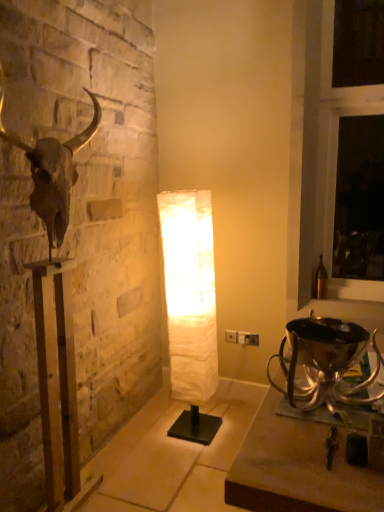
Describe the element at coordinates (190, 308) in the screenshot. The height and width of the screenshot is (512, 384). I see `white paper lamp at center` at that location.

Measure the distance between metallic gold bull skull at left and camera.

They are 1.54 meters apart.

Locate an element on the screen. The height and width of the screenshot is (512, 384). white marble lamp at center is located at coordinates [173, 456].

Looking at this image, how different are the orientations of shiny silver trophy at lower right and metallic gold bull skull at left in degrees?

The facing directions of shiny silver trophy at lower right and metallic gold bull skull at left are 1.25 degrees apart.

How distant is shiny silver trophy at lower right from metallic gold bull skull at left?

A distance of 1.15 meters exists between shiny silver trophy at lower right and metallic gold bull skull at left.

Considering their positions, is shiny silver trophy at lower right located in front of or behind metallic gold bull skull at left?

shiny silver trophy at lower right is in front of metallic gold bull skull at left.

Can you confirm if shiny silver trophy at lower right is smaller than metallic gold bull skull at left?

Correct, shiny silver trophy at lower right occupies less space than metallic gold bull skull at left.

Does white marble lamp at center come in front of white plastic electric outlet at center?

Yes, white marble lamp at center is in front of white plastic electric outlet at center.

Does point (226, 463) lie behind point (243, 332)?

No.

Is white marble lamp at center facing away from white plastic electric outlet at center?

That's not correct — white marble lamp at center is not looking away from white plastic electric outlet at center.

Locate an element on the screen. This screenshot has height=512, width=384. candle holder below the white paper lamp at center (from the image's perspective) is located at coordinates (325, 364).

Does point (185, 342) appear closer or farther from the camera than point (295, 392)?

Point (185, 342) appears to be farther away from the viewer than point (295, 392).

Is white paper lamp at center directly adjacent to shiny silver trophy at lower right?

There is a gap between white paper lamp at center and shiny silver trophy at lower right.

Could you tell me if white paper lamp at center is turned towards shiny silver trophy at lower right?

No.

What's the angular difference between white plastic electric outlet at center and metallic gold bull skull at left's facing directions?

white plastic electric outlet at center and metallic gold bull skull at left are facing 90 degrees away from each other.

This screenshot has height=512, width=384. In order to click on sculpture in front of the white plastic electric outlet at center in this screenshot , I will do `click(55, 304)`.

In the scene shown: Would you consider white plastic electric outlet at center to be distant from metallic gold bull skull at left?

Yes, white plastic electric outlet at center is far from metallic gold bull skull at left.

Is white plastic electric outlet at center oriented towards metallic gold bull skull at left?

No, white plastic electric outlet at center does not turn towards metallic gold bull skull at left.

Can you confirm if white marble lamp at center is smaller than white paper lamp at center?

Indeed, white marble lamp at center has a smaller size compared to white paper lamp at center.

What's the angular difference between white marble lamp at center and white paper lamp at center's facing directions?

The facing directions of white marble lamp at center and white paper lamp at center are 178 degrees apart.

Locate an element on the screen. lamp behind the white marble lamp at center is located at coordinates (190, 308).

In the image, is white marble lamp at center positioned in front of or behind white paper lamp at center?

Clearly, white marble lamp at center is in front of white paper lamp at center.

Based on the photo, from the image's perspective, is white plastic electric outlet at center positioned above or below white paper lamp at center?

From the image's perspective, white plastic electric outlet at center appears below white paper lamp at center.

Who is bigger, white plastic electric outlet at center or white paper lamp at center?

white paper lamp at center is bigger.

Where is `lamp lying above the white plastic electric outlet at center (from the image's perspective)`? The width and height of the screenshot is (384, 512). lamp lying above the white plastic electric outlet at center (from the image's perspective) is located at coordinates (190, 308).

Looking at this image, which object is thinner, white plastic electric outlet at center or white paper lamp at center?

With smaller width is white plastic electric outlet at center.

Does white marble lamp at center touch shiny silver trophy at lower right?

No.

Is white marble lamp at center taller or shorter than shiny silver trophy at lower right?

Considering their sizes, white marble lamp at center has less height than shiny silver trophy at lower right.

From the image's perspective, would you say white marble lamp at center is shown under shiny silver trophy at lower right?

Yes, from the image's perspective, white marble lamp at center is below shiny silver trophy at lower right.

How many degrees apart are the facing directions of white marble lamp at center and shiny silver trophy at lower right?

There is a 178-degree angle between the facing directions of white marble lamp at center and shiny silver trophy at lower right.

This screenshot has width=384, height=512. What are the coordinates of `candle holder in front of the metallic gold bull skull at left` in the screenshot? It's located at (325, 364).

Where is `electric outlet above the white marble lamp at center (from a real-world perspective)`? The width and height of the screenshot is (384, 512). electric outlet above the white marble lamp at center (from a real-world perspective) is located at coordinates (247, 338).

From the image, which object appears to be nearer to metallic gold bull skull at left, white marble lamp at center or shiny silver trophy at lower right?

Based on the image, white marble lamp at center appears to be nearer to metallic gold bull skull at left.

Estimate the real-world distances between objects in this image. Which object is further from white marble lamp at center, white paper lamp at center or metallic gold bull skull at left?

metallic gold bull skull at left is positioned further to the anchor white marble lamp at center.

Looking at the image, which one is located closer to white paper lamp at center, white plastic electric outlet at center or shiny silver trophy at lower right?

white plastic electric outlet at center lies closer to white paper lamp at center than the other object.

Considering their positions, is white plastic electric outlet at center positioned further to white paper lamp at center than metallic gold bull skull at left?

metallic gold bull skull at left is further to white paper lamp at center.

Based on their spatial positions, is white plastic electric outlet at center or metallic gold bull skull at left closer to shiny silver trophy at lower right?

metallic gold bull skull at left is positioned closer to the anchor shiny silver trophy at lower right.

Consider the image. Estimate the real-world distances between objects in this image. Which object is further from white plastic electric outlet at center, white paper lamp at center or shiny silver trophy at lower right?

Based on the image, shiny silver trophy at lower right appears to be further to white plastic electric outlet at center.

Based on the photo, estimate the real-world distances between objects in this image. Which object is further from white plastic electric outlet at center, shiny silver trophy at lower right or white paper lamp at center?

Based on the image, shiny silver trophy at lower right appears to be further to white plastic electric outlet at center.

Looking at the image, which one is located further to white paper lamp at center, shiny silver trophy at lower right or metallic gold bull skull at left?

Based on the image, shiny silver trophy at lower right appears to be further to white paper lamp at center.

You are a GUI agent. You are given a task and a screenshot of the screen. Output one action in this format:
    pyautogui.click(x=<x>, y=<y>)
    Task: Click on the concrete between shiny silver trophy at lower right and white plastic electric outlet at center from front to back
    The image size is (384, 512).
    Given the screenshot: What is the action you would take?
    pyautogui.click(x=173, y=456)

I want to click on sculpture between shiny silver trophy at lower right and white plastic electric outlet at center from front to back, so click(55, 304).

What are the coordinates of `lamp that lies between metallic gold bull skull at left and white marble lamp at center from top to bottom` in the screenshot? It's located at (190, 308).

Locate an element on the screen. Image resolution: width=384 pixels, height=512 pixels. concrete positioned between metallic gold bull skull at left and white plastic electric outlet at center from near to far is located at coordinates (173, 456).